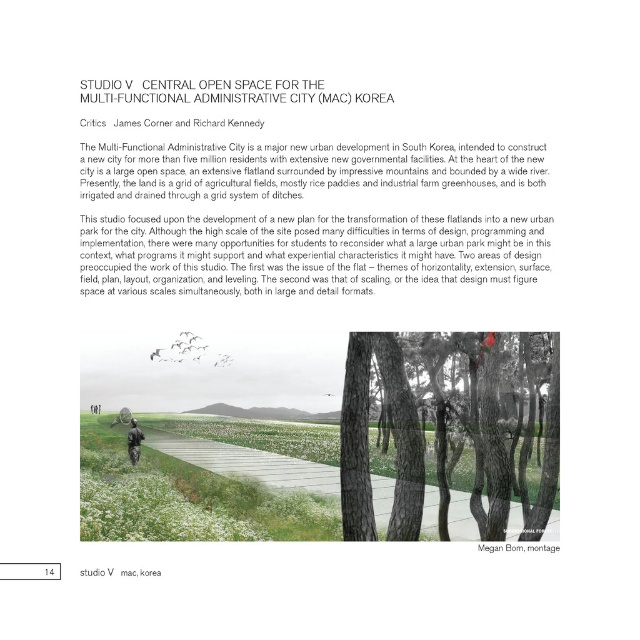
How distant is smooth bark tree at center from matte black person at center?

The distance of smooth bark tree at center from matte black person at center is 28.49 meters.

Does smooth bark tree at center have a lesser height compared to matte black person at center?

Indeed, smooth bark tree at center has a lesser height compared to matte black person at center.

Is point (342, 419) positioned in front of point (128, 442)?

Yes.

The image size is (640, 640). I want to click on smooth bark tree at center, so click(x=368, y=442).

Can you confirm if green grass at lower center is positioned to the right of matte black person at center?

Yes, green grass at lower center is to the right of matte black person at center.

What do you see at coordinates (248, 461) in the screenshot?
I see `green grass at lower center` at bounding box center [248, 461].

Which is behind, point (154, 442) or point (138, 452)?

Positioned behind is point (154, 442).

Identify the location of green grass at lower center. The height and width of the screenshot is (640, 640). (248, 461).

From the picture: Does smooth bark tree at center have a greater width compared to green grass at lower center?

In fact, smooth bark tree at center might be narrower than green grass at lower center.

Is smooth bark tree at center to the left of green grass at lower center from the viewer's perspective?

Incorrect, smooth bark tree at center is not on the left side of green grass at lower center.

Find the location of a particular element. The image size is (640, 640). smooth bark tree at center is located at coordinates (368, 442).

Where is `smooth bark tree at center`? smooth bark tree at center is located at coordinates (368, 442).